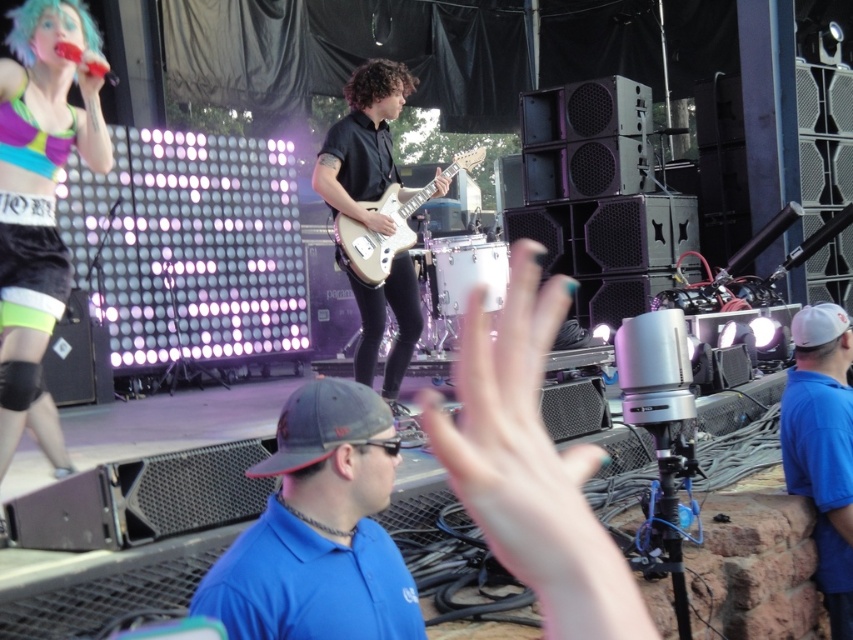
Question: Among these objects, which one is farthest from the camera?

Choices:
 (A) white glossy electric guitar at center
 (B) matte white guitar at center
 (C) blue cotton shirt at right
 (D) matte black shorts at left

Answer: (A)

Question: Is blue fabric shirt at center smaller than matte black shorts at left?

Choices:
 (A) no
 (B) yes

Answer: (B)

Question: Which point is farther to the camera?

Choices:
 (A) matte white guitar at center
 (B) matte black shorts at left
 (C) white glossy electric guitar at center
 (D) blue fabric shirt at center

Answer: (C)

Question: Which is nearer to the matte black shorts at left?

Choices:
 (A) white glossy electric guitar at center
 (B) blue fabric shirt at center
 (C) blue cotton shirt at right

Answer: (A)

Question: Can you confirm if blue fabric shirt at center is wider than white glossy electric guitar at center?

Choices:
 (A) yes
 (B) no

Answer: (B)

Question: Can you confirm if blue fabric shirt at center is smaller than matte white guitar at center?

Choices:
 (A) no
 (B) yes

Answer: (B)